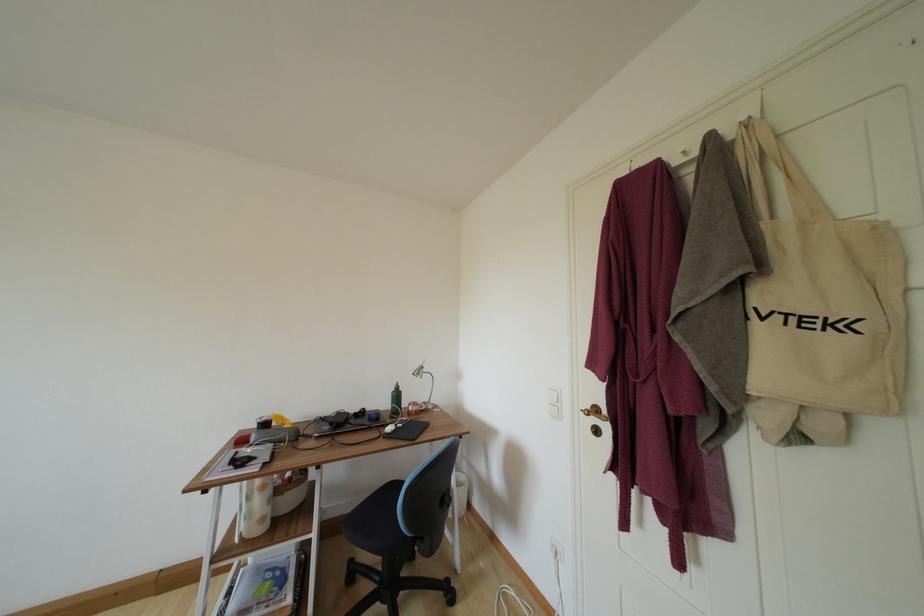
The width and height of the screenshot is (924, 616). Describe the element at coordinates (593, 411) in the screenshot. I see `the gold door handle` at that location.